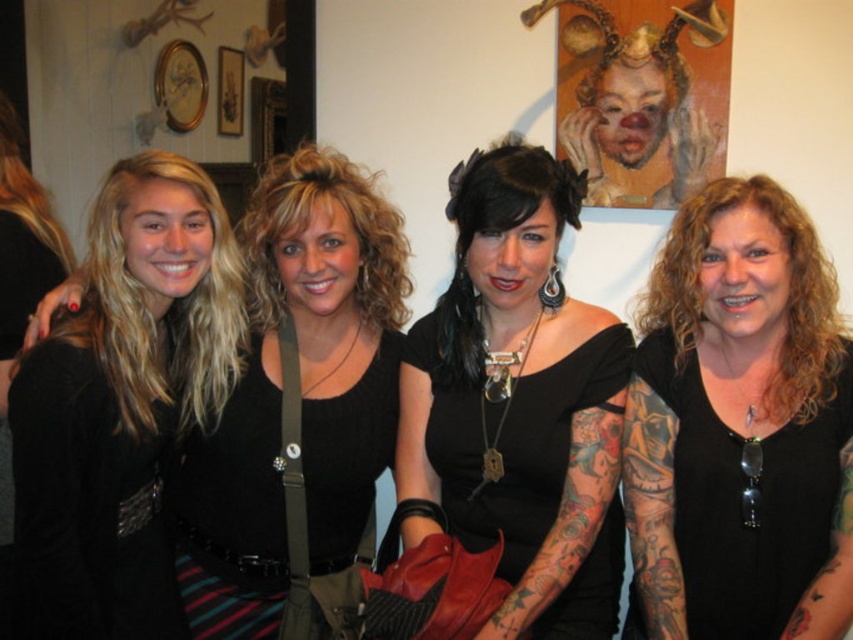
Question: Among these objects, which one is farthest from the camera?

Choices:
 (A) black matte shirt at right
 (B) black leather jacket at left
 (C) black knit top at center
 (D) black leather purse at center

Answer: (C)

Question: Is black leather purse at center smaller than black knit top at center?

Choices:
 (A) no
 (B) yes

Answer: (B)

Question: Is black leather purse at center bigger than black leather jacket at left?

Choices:
 (A) yes
 (B) no

Answer: (A)

Question: Which of these objects is positioned farthest from the black leather purse at center?

Choices:
 (A) black leather jacket at left
 (B) black matte shirt at right

Answer: (A)

Question: Which object is the farthest from the black knit top at center?

Choices:
 (A) black leather purse at center
 (B) black matte shirt at right
 (C) black leather jacket at left

Answer: (B)

Question: Can you confirm if black matte shirt at right is positioned above black leather purse at center?

Choices:
 (A) no
 (B) yes

Answer: (A)